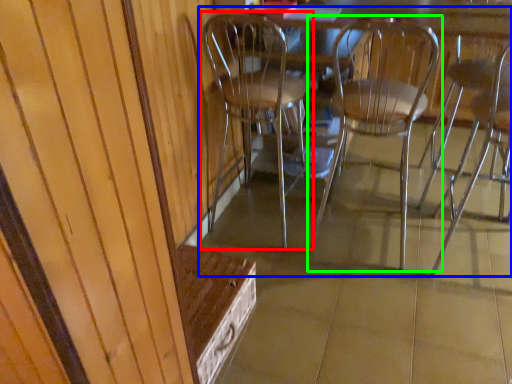
Question: Estimate the real-world distances between objects in this image. Which object is closer to chair (highlighted by a red box), chair (highlighted by a blue box) or chair (highlighted by a green box)?

Choices:
 (A) chair
 (B) chair

Answer: (A)